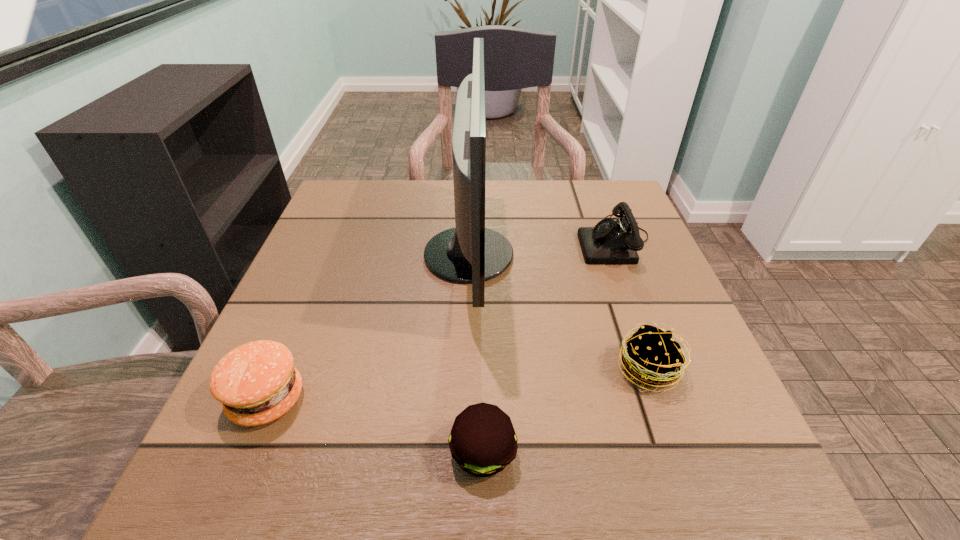
Where is `free spot at the near edge of the desktop`? Image resolution: width=960 pixels, height=540 pixels. free spot at the near edge of the desktop is located at coordinates (591, 450).

This screenshot has width=960, height=540. Identify the location of vacant space at the left edge of the desktop. (303, 366).

Locate an element on the screen. Image resolution: width=960 pixels, height=540 pixels. vacant space at the far right corner of the desktop is located at coordinates (596, 190).

Where is `free space between the telephone and the second patty from right to left`? free space between the telephone and the second patty from right to left is located at coordinates (549, 347).

Identify the location of empty location between the monitor and the rightmost patty. (559, 312).

At what (x,y) coordinates should I click in order to perform the action: click on unoccupied position between the rightmost patty and the tallest object. Please return your answer as a coordinate pair (x, y). Looking at the image, I should click on (559, 312).

Find the location of `unoccupied position between the telephone and the rightmost patty`. unoccupied position between the telephone and the rightmost patty is located at coordinates (632, 305).

Locate an element on the screen. The width and height of the screenshot is (960, 540). free point between the telephone and the rightmost patty is located at coordinates pos(632,305).

Find the location of a particular element. This screenshot has height=540, width=960. vacant space that's between the rightmost patty and the second patty from right to left is located at coordinates (565, 411).

Identify the location of free space between the second patty from right to left and the telephone. This screenshot has width=960, height=540. (549, 347).